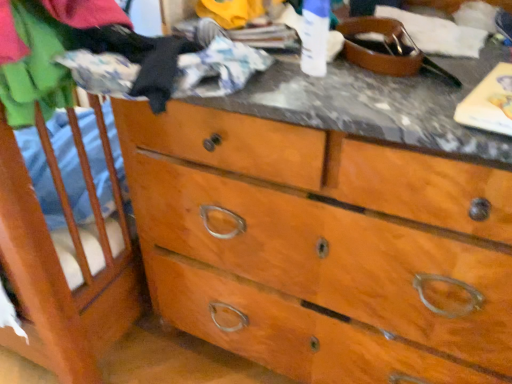
Question: In terms of width, does wooden dresser at center look wider or thinner when compared to soft cotton shirt at left?

Choices:
 (A) thin
 (B) wide

Answer: (B)

Question: From their relative heights in the image, would you say wooden dresser at center is taller or shorter than soft cotton shirt at left?

Choices:
 (A) short
 (B) tall

Answer: (B)

Question: Is wooden dresser at center bigger or smaller than soft cotton shirt at left?

Choices:
 (A) big
 (B) small

Answer: (A)

Question: Considering the positions of soft cotton shirt at left and wooden dresser at center in the image, is soft cotton shirt at left taller or shorter than wooden dresser at center?

Choices:
 (A) tall
 (B) short

Answer: (B)

Question: Relative to wooden dresser at center, is soft cotton shirt at left in front or behind?

Choices:
 (A) front
 (B) behind

Answer: (B)

Question: From a real-world perspective, is soft cotton shirt at left positioned above or below wooden dresser at center?

Choices:
 (A) above
 (B) below

Answer: (A)

Question: Considering the positions of soft cotton shirt at left and wooden dresser at center in the image, is soft cotton shirt at left wider or thinner than wooden dresser at center?

Choices:
 (A) thin
 (B) wide

Answer: (A)